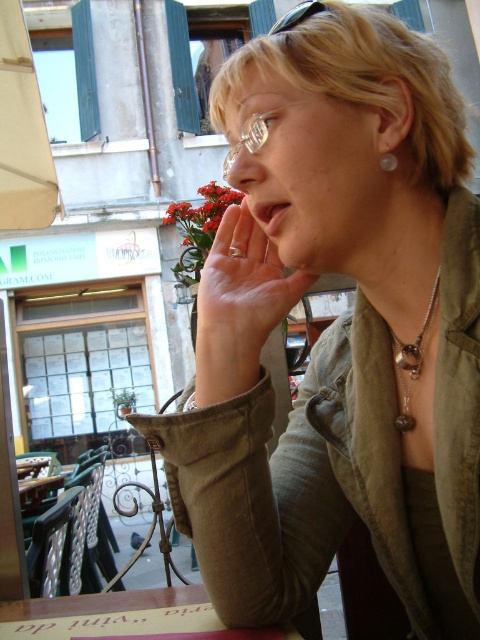
Is matte skin hand at center wider than wooden table at lower center?

In fact, matte skin hand at center might be narrower than wooden table at lower center.

Consider the image. Is matte skin hand at center to the right of wooden table at lower center from the viewer's perspective?

Indeed, matte skin hand at center is positioned on the right side of wooden table at lower center.

Does point (288, 291) come closer to viewer compared to point (168, 589)?

That is True.

Identify the location of matte skin hand at center. This screenshot has height=640, width=480. (242, 289).

Is matte skin hand at center positioned behind matte skin nose at center?

No, it is not.

Looking at this image, who is shorter, matte skin hand at center or matte skin nose at center?

matte skin nose at center

Describe the element at coordinates (242, 289) in the screenshot. The image size is (480, 640). I see `matte skin hand at center` at that location.

Where is `matte skin hand at center`? This screenshot has width=480, height=640. matte skin hand at center is located at coordinates (242, 289).

Can you confirm if matte olive-green jacket at center is positioned above silver metallic necklace at center?

Yes.

Is matte olive-green jacket at center in front of silver metallic necklace at center?

Yes.

Which is in front, point (298, 141) or point (421, 362)?

Point (298, 141) is in front.

Find the location of a particular element. This screenshot has height=640, width=480. matte olive-green jacket at center is located at coordinates (337, 330).